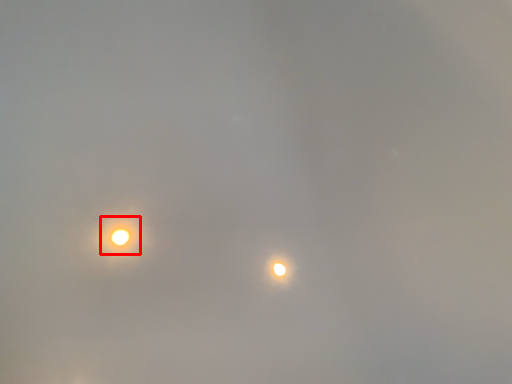
Question: From the image's perspective, considering the relative positions of moonlight (annotated by the red box) and moonlight in the image provided, where is moonlight (annotated by the red box) located with respect to the staircase?

Choices:
 (A) above
 (B) below

Answer: (A)